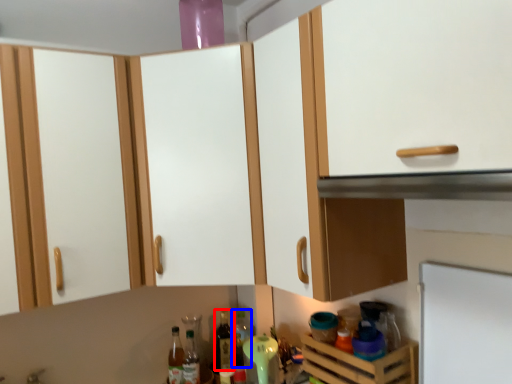
Question: Which of the following is the closest to the observer, bottle (highlighted by a red box) or bottle (highlighted by a blue box)?

Choices:
 (A) bottle
 (B) bottle

Answer: (A)